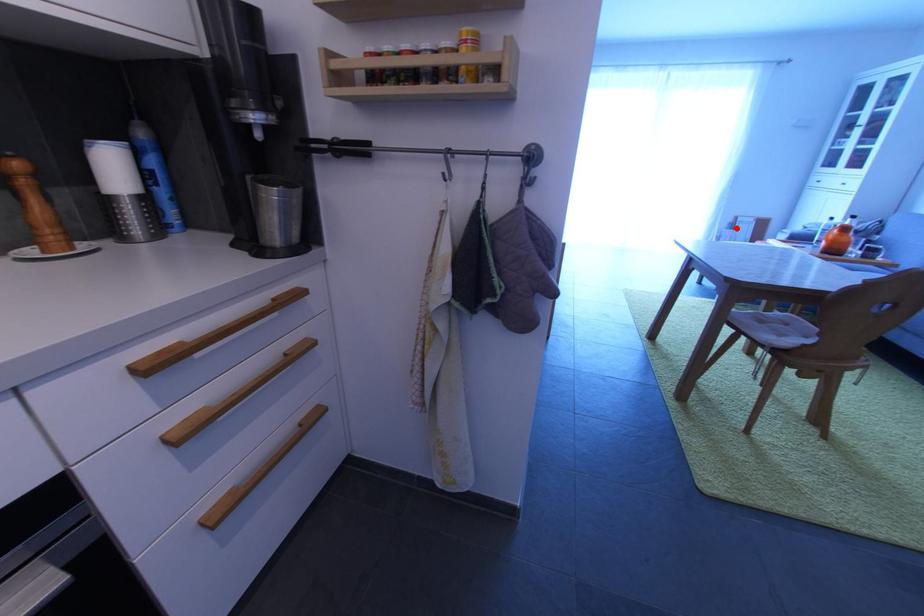
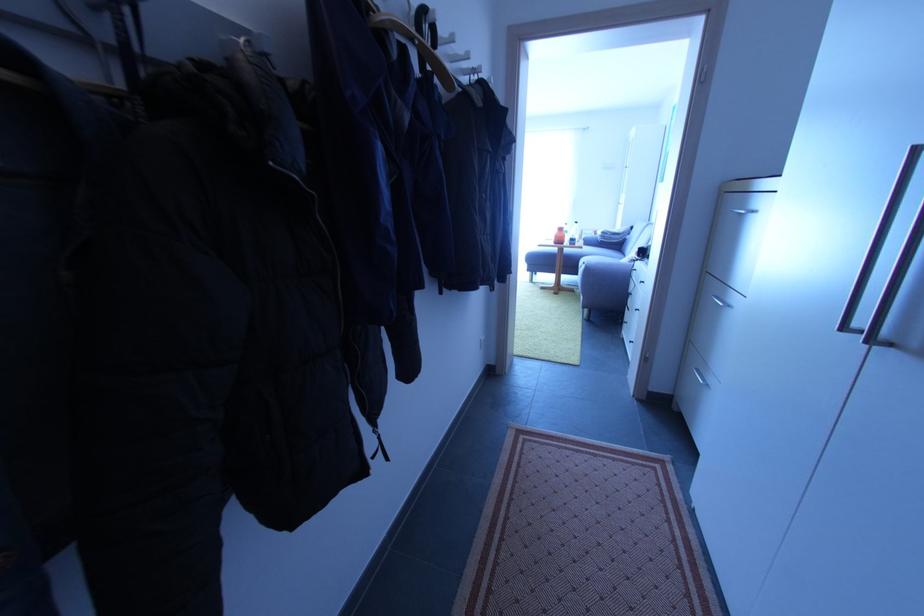
Find the pixel in the second image that matches the highlighted location in the first image.

(585, 238)